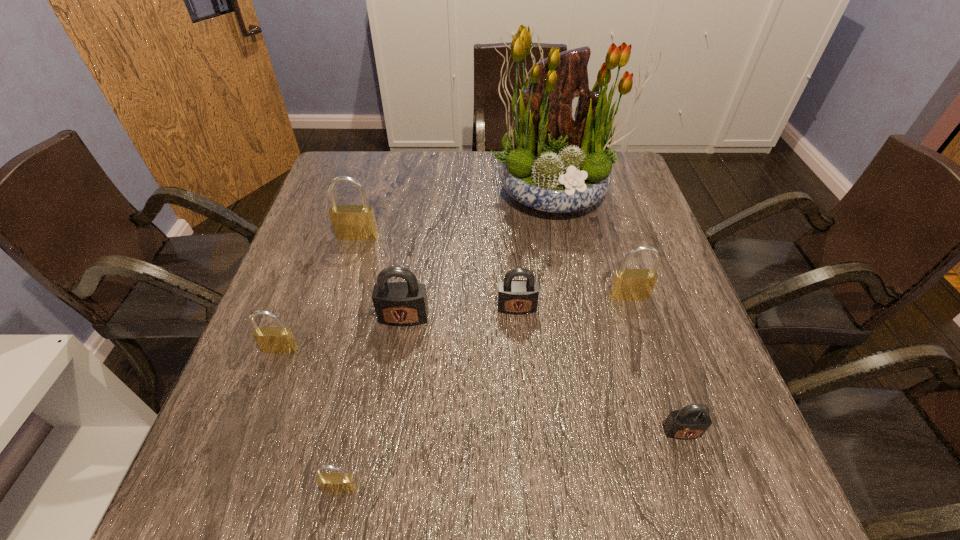
Where is `free location at the far left corner`? The width and height of the screenshot is (960, 540). free location at the far left corner is located at coordinates (348, 194).

This screenshot has height=540, width=960. In order to click on vacant space that's between the smallest brass padlock and the second smallest brass padlock in this screenshot , I will do `click(310, 418)`.

You are a GUI agent. You are given a task and a screenshot of the screen. Output one action in this format:
    pyautogui.click(x=<x>, y=<y>)
    Task: Click on the free area in between the biggest brass padlock and the third padlock from right to left
    
    Given the screenshot: What is the action you would take?
    pyautogui.click(x=437, y=272)

The height and width of the screenshot is (540, 960). In order to click on free space between the rightmost brass padlock and the leftmost padlock in this screenshot , I will do `click(455, 323)`.

At what (x,y) coordinates should I click in order to perform the action: click on free area in between the second object from left to right and the smallest brass padlock. Please return your answer as a coordinate pair (x, y). Image resolution: width=960 pixels, height=540 pixels. Looking at the image, I should click on [x=348, y=362].

You are a GUI agent. You are given a task and a screenshot of the screen. Output one action in this format:
    pyautogui.click(x=<x>, y=<y>)
    Task: Click on the vacant area between the biggest gray padlock and the smallest brass padlock
    This screenshot has height=540, width=960.
    Given the screenshot: What is the action you would take?
    pyautogui.click(x=372, y=403)

The width and height of the screenshot is (960, 540). I want to click on free space between the second brass padlock from right to left and the second gray padlock from right to left, so click(428, 398).

You are a GUI agent. You are given a task and a screenshot of the screen. Output one action in this format:
    pyautogui.click(x=<x>, y=<y>)
    Task: Click on the unoccupied position between the leftmost gray padlock and the second gray padlock from right to left
    
    Given the screenshot: What is the action you would take?
    pyautogui.click(x=460, y=313)

You are a GUI agent. You are given a task and a screenshot of the screen. Output one action in this format:
    pyautogui.click(x=<x>, y=<y>)
    Task: Click on the blank region between the biggest gray padlock and the farthest object
    This screenshot has height=540, width=960.
    Given the screenshot: What is the action you would take?
    pyautogui.click(x=480, y=254)

Image resolution: width=960 pixels, height=540 pixels. I want to click on empty location between the tallest object and the leftmost object, so click(418, 271).